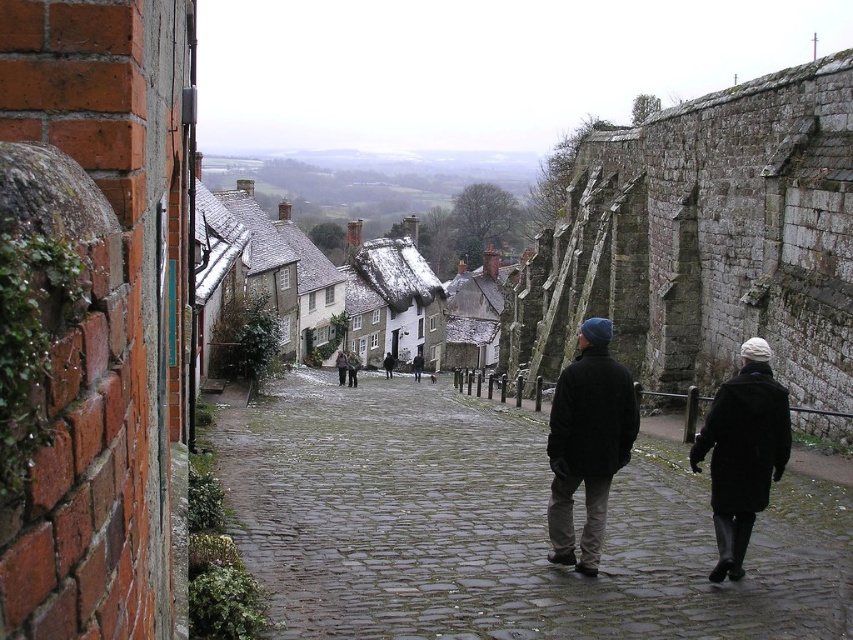
You are standing at the point marked as point [498,529] in the image. What is the surface you are currently standing on?

The surface at point [498,529] is a wet cobblestone alley at center.